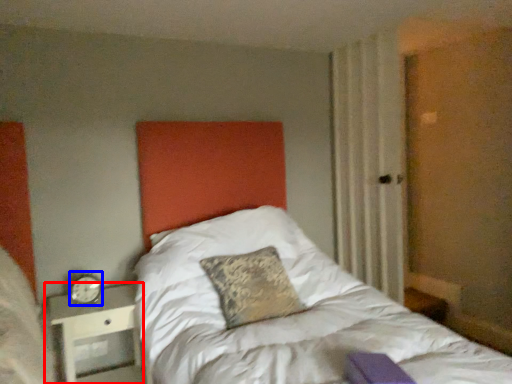
Question: Which point is further to the camera, nightstand (highlighted by a red box) or alarm clock (highlighted by a blue box)?

Choices:
 (A) nightstand
 (B) alarm clock

Answer: (B)